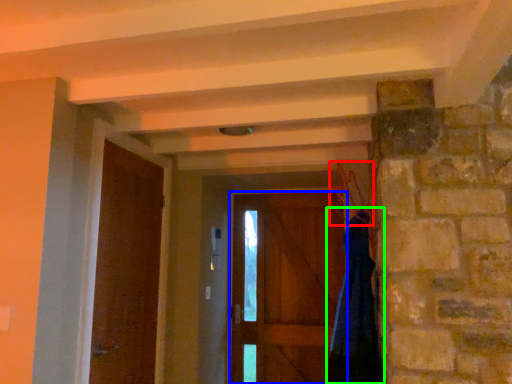
Question: Which object is the closest to the hanger (highlighted by a red box)? Choose among these: door (highlighted by a blue box) or dress (highlighted by a green box).

Choices:
 (A) door
 (B) dress

Answer: (B)